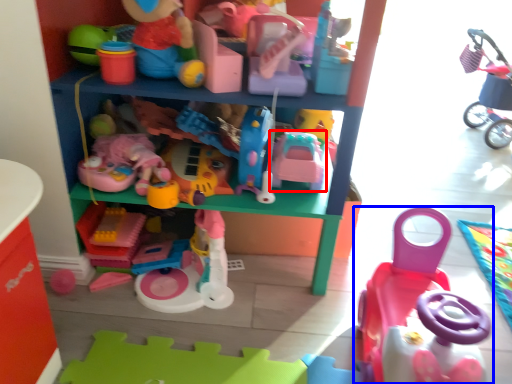
Question: Which of the following is the closest to the observer, toy (highlighted by a red box) or toy (highlighted by a blue box)?

Choices:
 (A) toy
 (B) toy

Answer: (B)